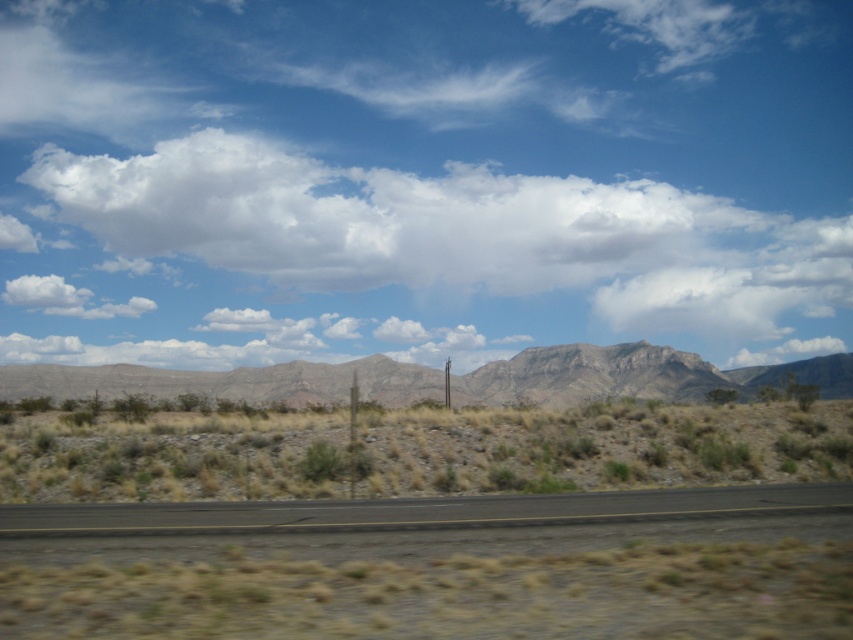
You are a hiker planning to cross the desert. You see a white fluffy cloud at upper center and a rugged stone mountain at center. Which object is wider?

The white fluffy cloud at upper center is wider than the rugged stone mountain at center.

You are driving along the two lanes road in the desert. There are two points marked on your GPS. One is at point (276, 413) and the other is at point (109, 385). If you are facing the direction of the road, which point is closer to you?

Point (276, 413) is in front of point (109, 385), so if you are facing the direction of the road, point (276, 413) is closer to you.

You are a drone operator trying to capture a photo of the rugged stone mountain at center from above the white fluffy cloud at upper center. Given the altitude requirement of your drone, which can only fly up to 20 meters, will you be able to position the drone high enough to achieve this shot?

The distance between the white fluffy cloud at upper center and the rugged stone mountain at center is 16.49 meters. Since your drone can fly up to 20 meters, it can reach the required altitude to capture the photo from above the white fluffy cloud at upper center.